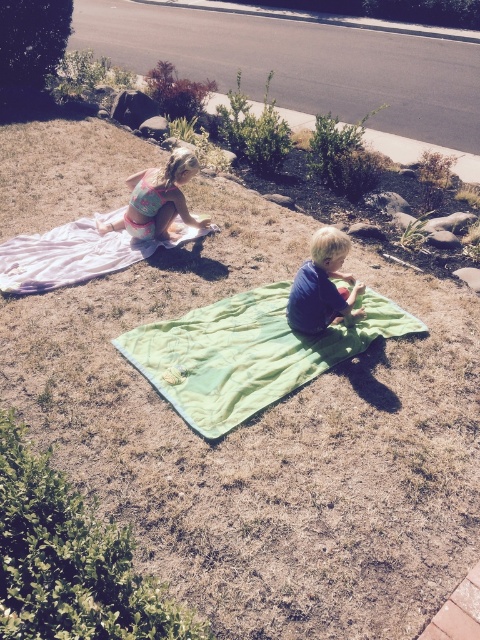
Does green quilted blanket at center have a greater height compared to pink fabric blanket at upper left?

Yes, green quilted blanket at center is taller than pink fabric blanket at upper left.

Does green quilted blanket at center appear on the right side of pink fabric blanket at upper left?

Yes, green quilted blanket at center is to the right of pink fabric blanket at upper left.

Describe the element at coordinates (248, 353) in the screenshot. I see `green quilted blanket at center` at that location.

I want to click on green quilted blanket at center, so tap(248, 353).

Which is behind, point (76, 237) or point (337, 253)?

The point (76, 237) is more distant.

Identify the location of pink fabric blanket at upper left. (76, 253).

How much distance is there between green quilted blanket at center and blue cotton shirt at center?

green quilted blanket at center is 15.17 inches from blue cotton shirt at center.

Who is positioned more to the right, green quilted blanket at center or blue cotton shirt at center?

blue cotton shirt at center

This screenshot has width=480, height=640. Identify the location of green quilted blanket at center. (248, 353).